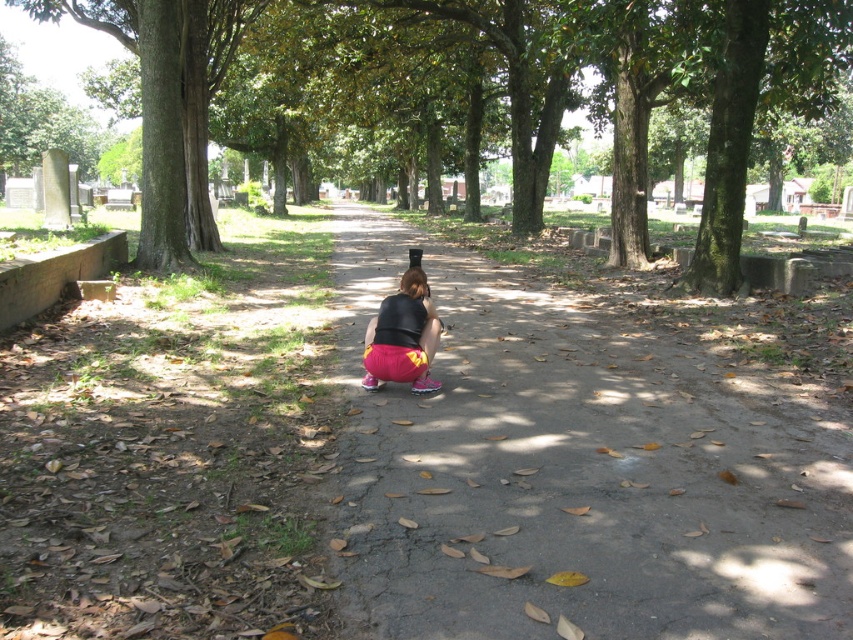
Question: Can you confirm if green rough bark tree at center is positioned above pink matte shorts at center?

Choices:
 (A) no
 (B) yes

Answer: (B)

Question: Does dirt path at center appear over green rough bark tree at center?

Choices:
 (A) yes
 (B) no

Answer: (B)

Question: Which is farther from the pink matte shorts at center?

Choices:
 (A) dirt path at center
 (B) green rough bark tree at center

Answer: (B)

Question: Is dirt path at center bigger than green rough bark tree at center?

Choices:
 (A) no
 (B) yes

Answer: (A)

Question: Among these objects, which one is nearest to the camera?

Choices:
 (A) pink matte shorts at center
 (B) green rough bark tree at center
 (C) dirt path at center

Answer: (C)

Question: Which point is farther from the camera taking this photo?

Choices:
 (A) (311, 80)
 (B) (526, 330)

Answer: (A)